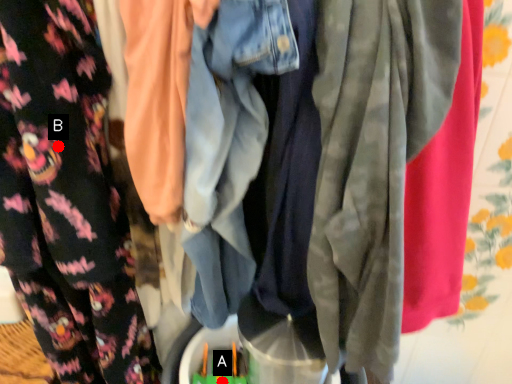
Question: Two points are circled on the image, labeled by A and B beside each circle. Among these points, which one is nearest to the camera?

Choices:
 (A) A is closer
 (B) B is closer

Answer: (B)